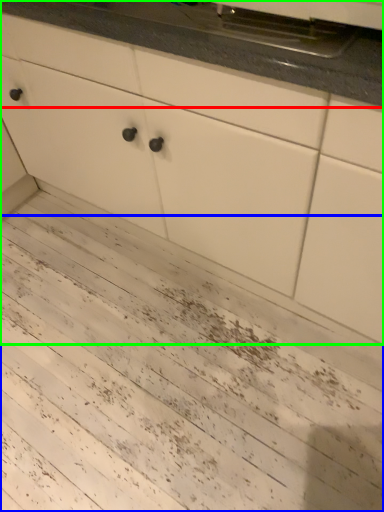
Question: Which is nearer to the countertop (highlighted by a red box)? mud (highlighted by a blue box) or cabinetry (highlighted by a green box).

Choices:
 (A) mud
 (B) cabinetry

Answer: (B)